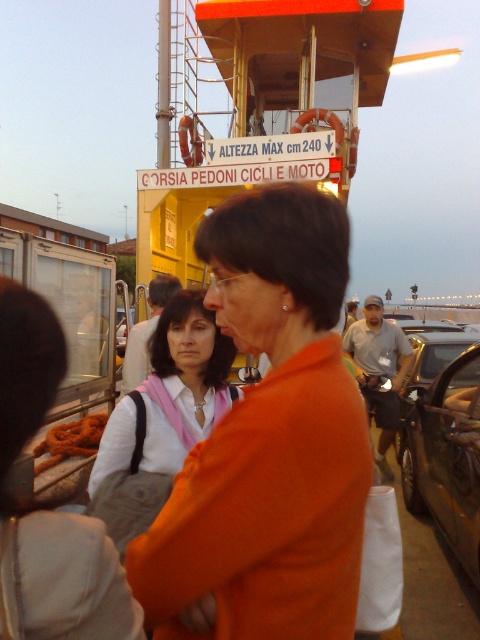
Consider the image. You are standing at the ferry embarkation point in the evening. You see an orange fabric bag at center. Can you reach it without moving your feet?

The orange fabric bag at center is 31.12 inches away from you, so you cannot reach it without moving your feet since the distance is too far.

You are a photographer standing at the ferry embarkation point. You want to take a photo of the yellow matte ferry at upper center without any people blocking it. Is the orange fabric at center currently blocking the ferry in your view?

The orange fabric at center is in front of the yellow matte ferry at upper center, so it is blocking the ferry in your view. You will need to move the orange fabric at center or reposition yourself to capture an unobstructed view of the ferry.

You are standing at the ferry embarkation point during evening. You see a point at coordinates (x=268, y=442). What object is located at that point?

The point at coordinates (x=268, y=442) corresponds to the orange fabric at center.